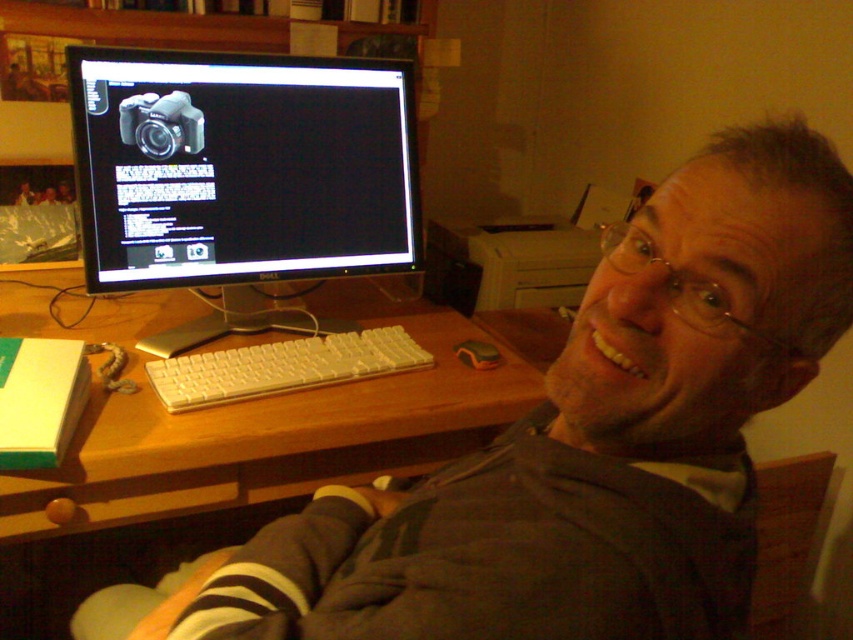
Which is in front, point (91, 284) or point (79, 490)?

Point (79, 490)

This screenshot has width=853, height=640. What do you see at coordinates (241, 166) in the screenshot? I see `black glossy monitor at upper left` at bounding box center [241, 166].

Who is more forward, [401,269] or [430,321]?

Positioned in front is point [401,269].

Locate an element on the screen. This screenshot has width=853, height=640. black glossy monitor at upper left is located at coordinates (241, 166).

Can you confirm if wooden at center is wider than white plastic keyboard at center?

Correct, the width of wooden at center exceeds that of white plastic keyboard at center.

In the scene shown: Between wooden at center and white plastic keyboard at center, which one has less height?

With less height is white plastic keyboard at center.

Is point (132, 376) behind point (408, 349)?

That is False.

Find the location of a particular element. wooden at center is located at coordinates (247, 413).

Can you confirm if black glossy monitor at upper left is positioned to the left of white plastic keyboard at center?

Correct, you'll find black glossy monitor at upper left to the left of white plastic keyboard at center.

What do you see at coordinates (241, 166) in the screenshot? I see `black glossy monitor at upper left` at bounding box center [241, 166].

Is point (187, 70) in front of point (322, 371)?

No, it is not.

I want to click on black glossy monitor at upper left, so click(x=241, y=166).